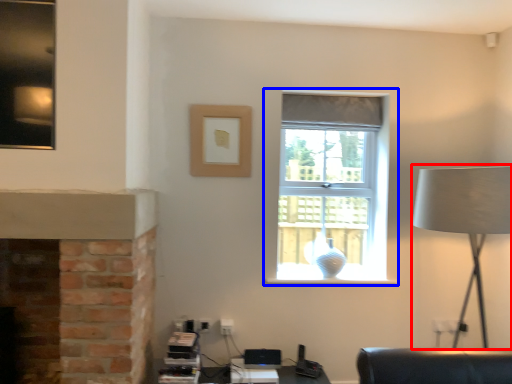
Question: Which of the following is the farthest to the observer, table lamp (highlighted by a red box) or window (highlighted by a blue box)?

Choices:
 (A) table lamp
 (B) window

Answer: (B)